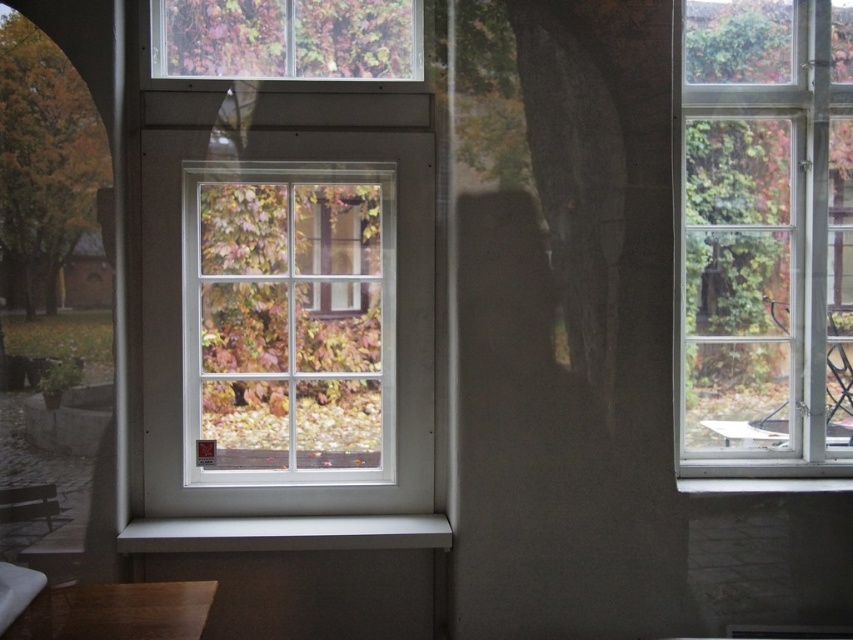
Question: Which point is closer to the camera taking this photo?

Choices:
 (A) (177, 600)
 (B) (317, 476)

Answer: (A)

Question: Which of the following is the closest to the observer?

Choices:
 (A) (757, 72)
 (B) (135, 625)
 (C) (398, 522)

Answer: (B)

Question: Can you confirm if white glass window at center is bigger than white smooth window sill at center?

Choices:
 (A) no
 (B) yes

Answer: (B)

Question: Which object is the farthest from the white smooth window sill at center?

Choices:
 (A) white glass window at center
 (B) wooden table at lower left
 (C) translucent glass window at upper center

Answer: (C)

Question: Can you confirm if white glass window at center is positioned below translucent glass window at upper center?

Choices:
 (A) no
 (B) yes

Answer: (B)

Question: Can you confirm if clear glass window at right is positioned to the right of translucent glass window at upper center?

Choices:
 (A) no
 (B) yes

Answer: (B)